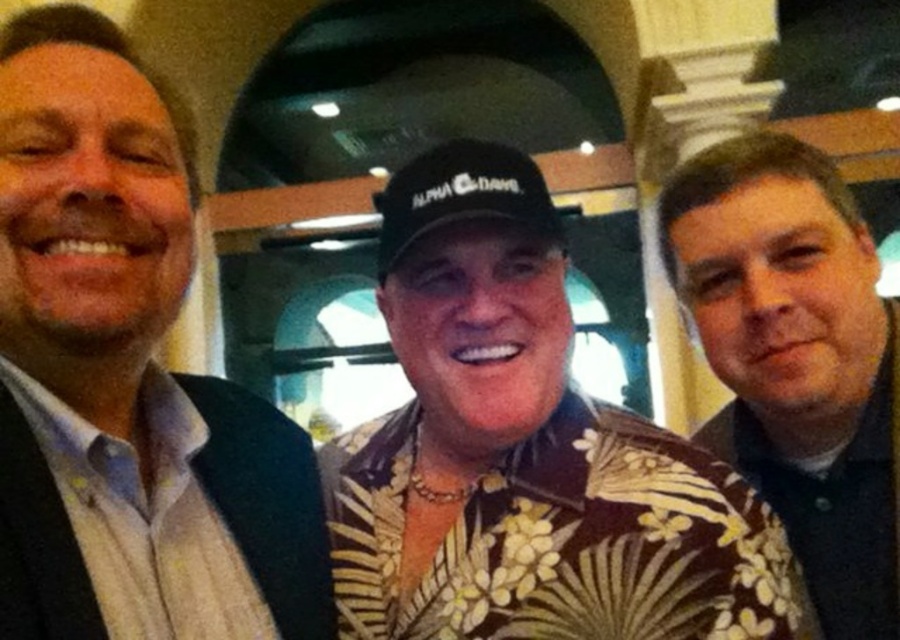
You are at a social event and want to take a photo with the people in the image. The photographer asks you to stand in a position where you can see both the white shirt at left and the brown floral shirt at center. Based on their positions, where should you stand relative to them?

You should stand to the right of the brown floral shirt at center so that you can see both the white shirt at left and the brown floral shirt at center since the white shirt at left is located above the brown floral shirt at center.

You are a photographer setting up for a group photo. You have a camera with a focal length of 50mm and want to ensure that the brown floral shirt at center is in sharp focus. If the recommended focus distance for this setup is between 30 to 35 inches, will the current distance of 33.09 inches work?

Yes, the current distance of 33.09 inches for the brown floral shirt at center falls within the recommended focus range of 30 to 35 inches, so it will be in sharp focus.